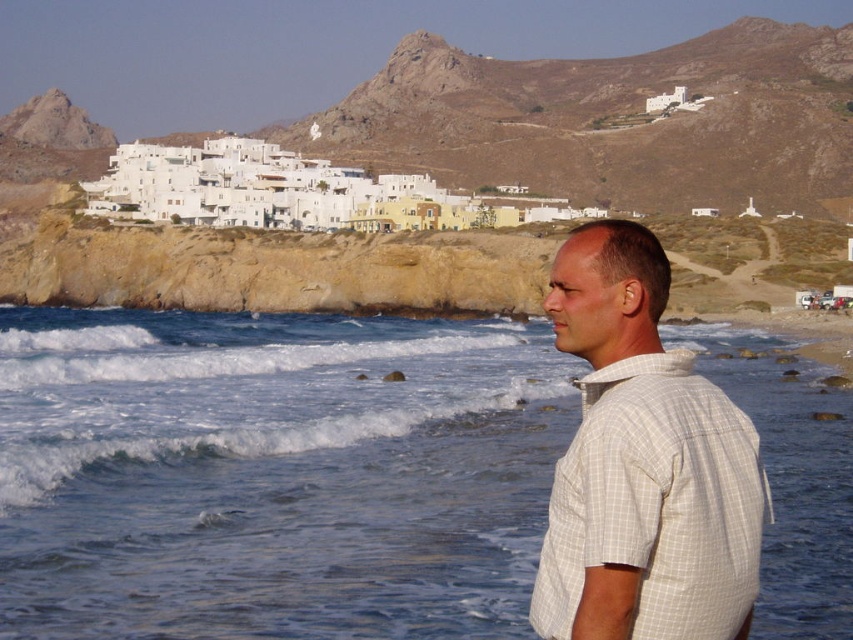
Between blue water at lower left and white checkered shirt at right, which one appears on the right side from the viewer's perspective?

white checkered shirt at right

In the scene shown: Is blue water at lower left wider than white checkered shirt at right?

Yes, blue water at lower left is wider than white checkered shirt at right.

The width and height of the screenshot is (853, 640). In order to click on blue water at lower left in this screenshot , I will do `click(273, 474)`.

You are a GUI agent. You are given a task and a screenshot of the screen. Output one action in this format:
    pyautogui.click(x=<x>, y=<y>)
    Task: Click on the blue water at lower left
    
    Given the screenshot: What is the action you would take?
    pyautogui.click(x=273, y=474)